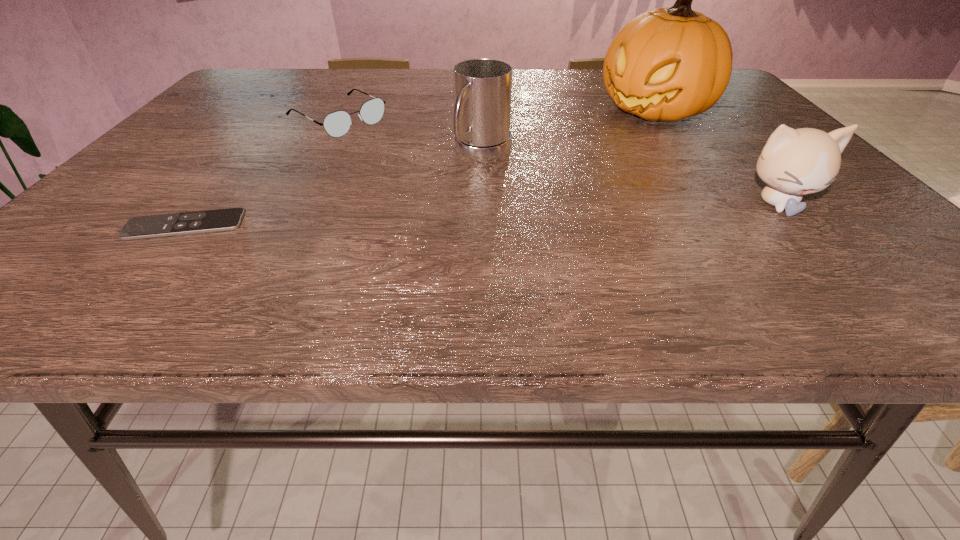
The height and width of the screenshot is (540, 960). In order to click on pumpkin at the right edge in this screenshot , I will do `click(667, 64)`.

Identify the location of object at the near left corner. The width and height of the screenshot is (960, 540). (162, 225).

Identify the location of object situated at the far right corner. (667, 64).

Locate an element on the screen. free space at the far edge of the desktop is located at coordinates (440, 70).

Find the location of `free space at the left edge of the desktop`. free space at the left edge of the desktop is located at coordinates (162, 154).

Locate an element on the screen. vacant area at the right edge of the desktop is located at coordinates (756, 118).

I want to click on free space at the far left corner of the desktop, so (281, 90).

This screenshot has width=960, height=540. I want to click on vacant area between the second shortest object and the third object from right to left, so click(x=410, y=137).

Locate an element on the screen. This screenshot has width=960, height=540. vacant area that lies between the tallest object and the remote control is located at coordinates (420, 168).

Find the location of a particular element. free space that is in between the pumpkin and the kitten is located at coordinates (715, 157).